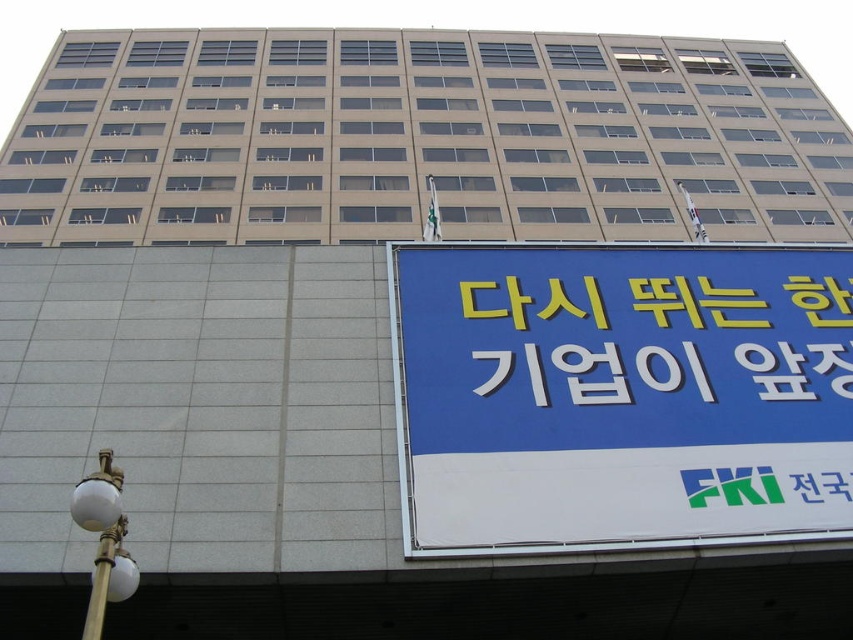
You are standing at the corner of the street looking at the building. You see a gold metallic streetlight at lower left and a metallic pole at lower left. Which one is positioned more to the right side?

The gold metallic streetlight at lower left is positioned more to the right side than the metallic pole at lower left.

You are a delivery person trying to read the yellow plastic sign at center and the metallic pole at lower left from across the street. Which object is taller?

The yellow plastic sign at center is taller than the metallic pole at lower left according to the description.